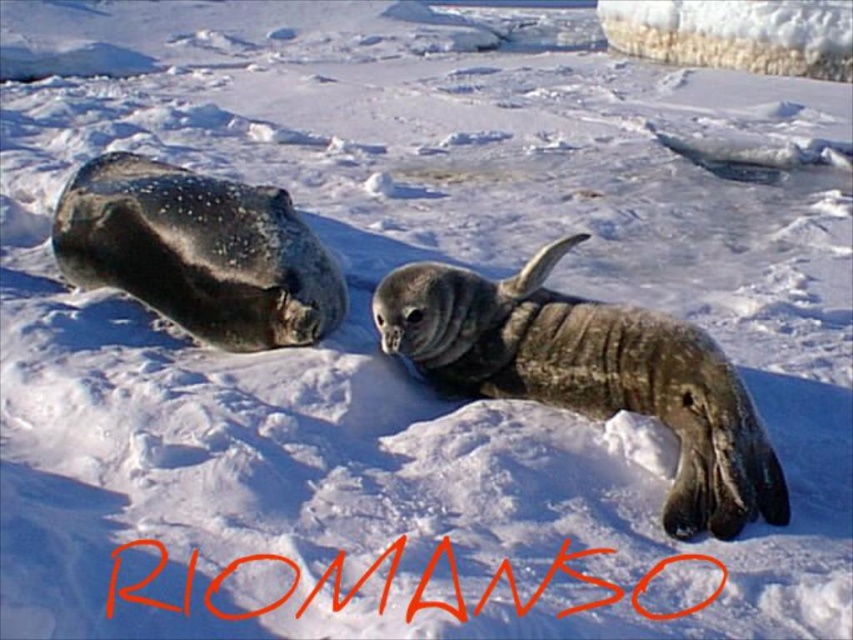
Question: Does grayish-brown fur seal at center have a lesser width compared to speckled fur seal at left?

Choices:
 (A) no
 (B) yes

Answer: (B)

Question: Which of the following is the farthest from the observer?

Choices:
 (A) speckled fur seal at left
 (B) grayish-brown fur seal at center

Answer: (A)

Question: Can you confirm if grayish-brown fur seal at center is positioned to the right of speckled fur seal at left?

Choices:
 (A) no
 (B) yes

Answer: (B)

Question: Is grayish-brown fur seal at center below speckled fur seal at left?

Choices:
 (A) yes
 (B) no

Answer: (A)

Question: Which of the following is the farthest from the observer?

Choices:
 (A) [x=492, y=388]
 (B) [x=312, y=298]

Answer: (B)